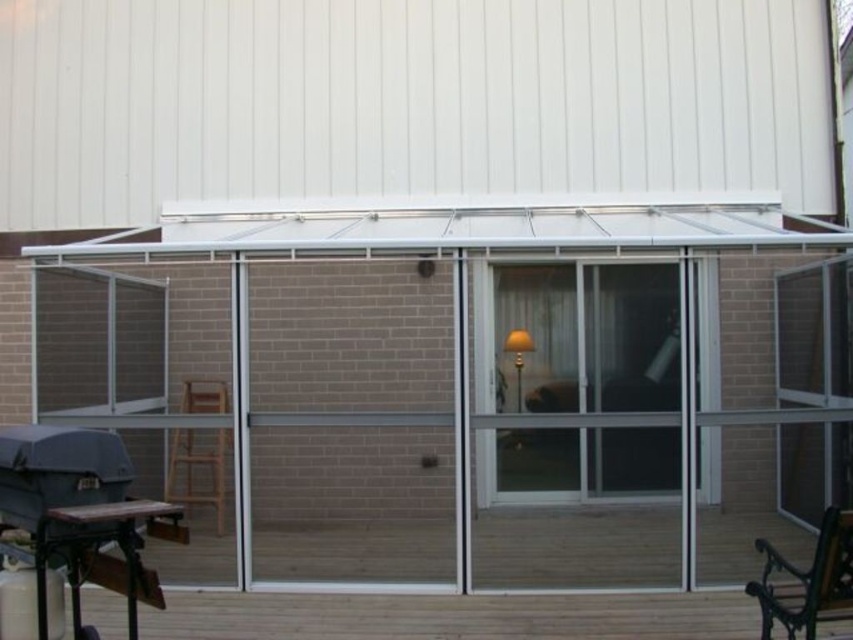
From the picture: Does wooden deck at lower center come behind wooden chair at lower left?

No, wooden deck at lower center is closer to the viewer.

Can you confirm if wooden deck at lower center is wider than wooden chair at lower left?

Correct, the width of wooden deck at lower center exceeds that of wooden chair at lower left.

Who is more forward, (254, 611) or (173, 483)?

Point (254, 611) is more forward.

You are a GUI agent. You are given a task and a screenshot of the screen. Output one action in this format:
    pyautogui.click(x=<x>, y=<y>)
    Task: Click on the wooden deck at lower center
    This screenshot has width=853, height=640.
    Given the screenshot: What is the action you would take?
    pyautogui.click(x=451, y=616)

Is matte black barbecue grill at lower left in front of wooden chair at lower left?

That is True.

Where is `matte black barbecue grill at lower left`? The width and height of the screenshot is (853, 640). matte black barbecue grill at lower left is located at coordinates (80, 515).

At what (x,y) coordinates should I click in order to perform the action: click on matte black barbecue grill at lower left. Please return your answer as a coordinate pair (x, y). The width and height of the screenshot is (853, 640). Looking at the image, I should click on (80, 515).

Based on the photo, does clear glass screen door at center have a greater width compared to wooden deck at lower center?

In fact, clear glass screen door at center might be narrower than wooden deck at lower center.

The image size is (853, 640). Identify the location of clear glass screen door at center. (579, 429).